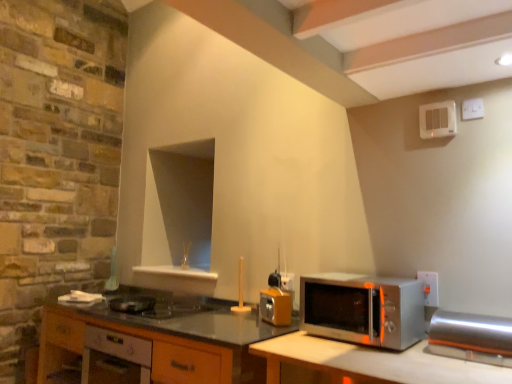
Question: In terms of width, does wooden cabinet at lower left, placed as the second cabinetry when sorted from left to right, look wider or thinner when compared to white plastic electric outlet at right, the first electric outlet from the left?

Choices:
 (A) wide
 (B) thin

Answer: (A)

Question: Does point (181, 354) appear closer or farther from the camera than point (290, 284)?

Choices:
 (A) farther
 (B) closer

Answer: (B)

Question: Based on their relative distances, which object is farther from the satin silver microwave at right?

Choices:
 (A) wooden cabinet at lower left, the first cabinetry from the left
 (B) white plastic electric outlet at right, the first electric outlet from the front
 (C) shiny metallic pan at center, positioned as the 1th appliance in back-to-front order
 (D) satin silver toaster oven at right, which ranks as the third appliance in back-to-front order
 (E) white plastic electric outlet at right, marked as the first electric outlet in a back-to-front arrangement

Answer: (C)

Question: Estimate the real-world distances between objects in this image. Which object is closer to the wooden cabinet at lower left, the first cabinetry from the left?

Choices:
 (A) white plastic electric outlet at right, the first electric outlet from the front
 (B) satin silver toaster oven at right, the first appliance from the front
 (C) white plastic exhaust fan at upper right, the 2th appliance viewed from the back
 (D) shiny metallic pan at center, which is the third appliance in right-to-left order
 (E) satin silver microwave at right

Answer: (E)